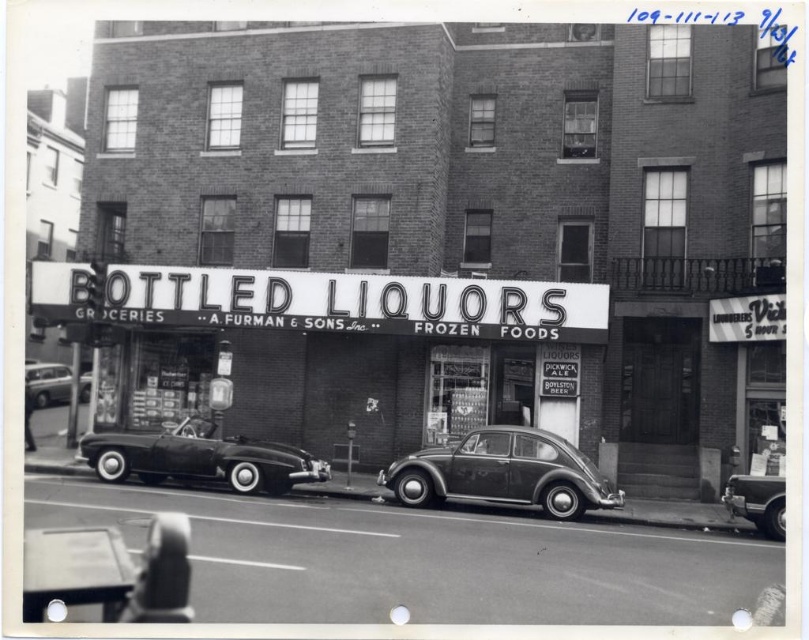
Between point (439, 458) and point (761, 477), which one is positioned in front?

Positioned in front is point (761, 477).

Who is more forward, (543, 435) or (752, 483)?

Point (752, 483) is in front.

This screenshot has width=809, height=640. I want to click on matte gray car at center, so [x=503, y=472].

Which of these two, matte white sign at center or shiny silver sedan at left, stands taller?

matte white sign at center is taller.

Does point (523, 316) lie behind point (34, 396)?

No, (523, 316) is in front of (34, 396).

Locate an element on the screen. matte white sign at center is located at coordinates (320, 301).

Does matte white sign at center appear on the right side of shiny silver sedan at lower right?

Incorrect, matte white sign at center is not on the right side of shiny silver sedan at lower right.

Which is below, matte white sign at center or shiny silver sedan at lower right?

shiny silver sedan at lower right is below.

What do you see at coordinates (320, 301) in the screenshot? The image size is (809, 640). I see `matte white sign at center` at bounding box center [320, 301].

Locate an element on the screen. matte white sign at center is located at coordinates (320, 301).